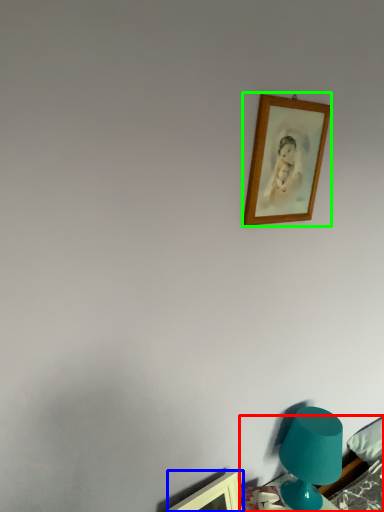
Question: Which is farther away from furniture (highlighted by a red box)? picture frame (highlighted by a blue box) or picture frame (highlighted by a green box)?

Choices:
 (A) picture frame
 (B) picture frame

Answer: (B)